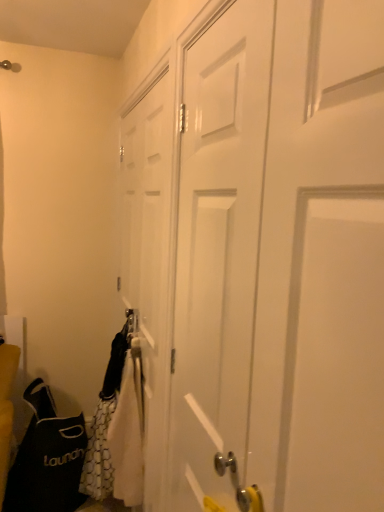
Question: From a real-world perspective, is black fabric laundry bag at lower left located higher than white matte door at center, which is counted as the first door, starting from the front?

Choices:
 (A) yes
 (B) no

Answer: (B)

Question: Can you confirm if black fabric laundry bag at lower left is wider than white matte door at center, which is counted as the first door, starting from the front?

Choices:
 (A) no
 (B) yes

Answer: (B)

Question: Is black fabric laundry bag at lower left at the right side of white matte door at center, the second door in the back-to-front sequence?

Choices:
 (A) no
 (B) yes

Answer: (A)

Question: Can white matte door at center, which is counted as the first door, starting from the front, be found inside black fabric laundry bag at lower left?

Choices:
 (A) no
 (B) yes

Answer: (A)

Question: Can you see black fabric laundry bag at lower left touching white matte door at center, which is counted as the first door, starting from the front?

Choices:
 (A) yes
 (B) no

Answer: (B)

Question: From a real-world perspective, relative to white matte door at center, the first door viewed from the back, is white matte door at center, the second door in the back-to-front sequence, vertically above or below?

Choices:
 (A) above
 (B) below

Answer: (B)

Question: From the image's perspective, relative to white matte door at center, which appears as the second door when viewed from the front, is white matte door at center, the second door in the back-to-front sequence, above or below?

Choices:
 (A) below
 (B) above

Answer: (A)

Question: Looking at the image, does white matte door at center, which is counted as the first door, starting from the front, seem bigger or smaller compared to white matte door at center, the first door viewed from the back?

Choices:
 (A) small
 (B) big

Answer: (B)

Question: Looking at their shapes, would you say white matte door at center, the second door in the back-to-front sequence, is wider or thinner than white matte door at center, the first door viewed from the back?

Choices:
 (A) thin
 (B) wide

Answer: (B)

Question: Is black fabric laundry bag at lower left spatially inside white matte door at center, which is counted as the first door, starting from the front, or outside of it?

Choices:
 (A) outside
 (B) inside

Answer: (A)

Question: Considering their positions, is black fabric laundry bag at lower left located in front of or behind white matte door at center, which is counted as the first door, starting from the front?

Choices:
 (A) behind
 (B) front

Answer: (A)

Question: Based on their positions, is black fabric laundry bag at lower left located to the left or right of white matte door at center, which is counted as the first door, starting from the front?

Choices:
 (A) right
 (B) left

Answer: (B)

Question: Considering the positions of black fabric laundry bag at lower left and white matte door at center, the second door in the back-to-front sequence, in the image, is black fabric laundry bag at lower left taller or shorter than white matte door at center, the second door in the back-to-front sequence,?

Choices:
 (A) tall
 (B) short

Answer: (B)

Question: Would you say black fabric laundry bag at lower left is inside or outside white matte door at center, which appears as the second door when viewed from the front?

Choices:
 (A) inside
 (B) outside

Answer: (B)

Question: Looking at the image, does black fabric laundry bag at lower left seem bigger or smaller compared to white matte door at center, which appears as the second door when viewed from the front?

Choices:
 (A) big
 (B) small

Answer: (A)